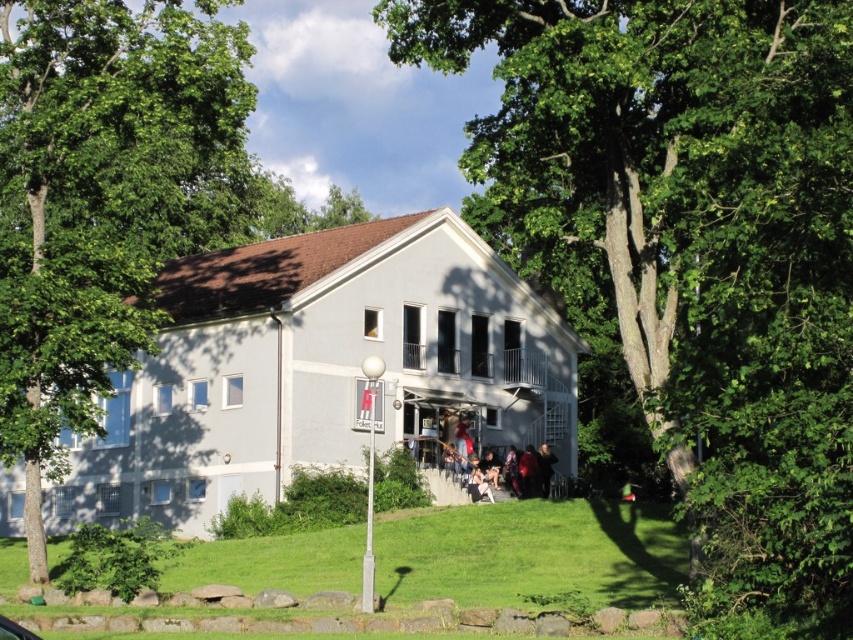
This screenshot has width=853, height=640. What do you see at coordinates (106, 198) in the screenshot? I see `green leafy tree at upper left` at bounding box center [106, 198].

The image size is (853, 640). I want to click on green leafy tree at upper left, so click(x=106, y=198).

Is green leafy tree at upper left below green grass at lower center?

Incorrect, green leafy tree at upper left is not positioned below green grass at lower center.

Which of these two, green leafy tree at upper left or green grass at lower center, stands shorter?

With less height is green grass at lower center.

Is point (78, 326) positioned in front of point (540, 525)?

Yes, it is.

You are a GUI agent. You are given a task and a screenshot of the screen. Output one action in this format:
    pyautogui.click(x=<x>, y=<y>)
    Task: Click on the green leafy tree at upper left
    
    Given the screenshot: What is the action you would take?
    click(x=106, y=198)

How far apart are green grass at lower center and denim jacket at lower center?

green grass at lower center is 19.54 meters from denim jacket at lower center.

Who is more distant from viewer, (511, 586) or (489, 488)?

The point (489, 488) is behind.

Find the location of `green grass at lower center`. green grass at lower center is located at coordinates (532, 554).